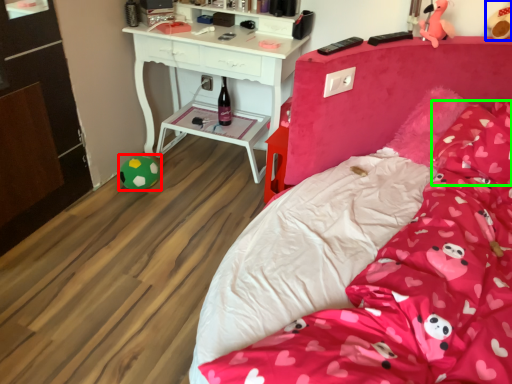
Question: Which object is positioned farthest from toy (highlighted by a red box)? Select from toy (highlighted by a blue box) and pillow (highlighted by a green box).

Choices:
 (A) toy
 (B) pillow

Answer: (A)